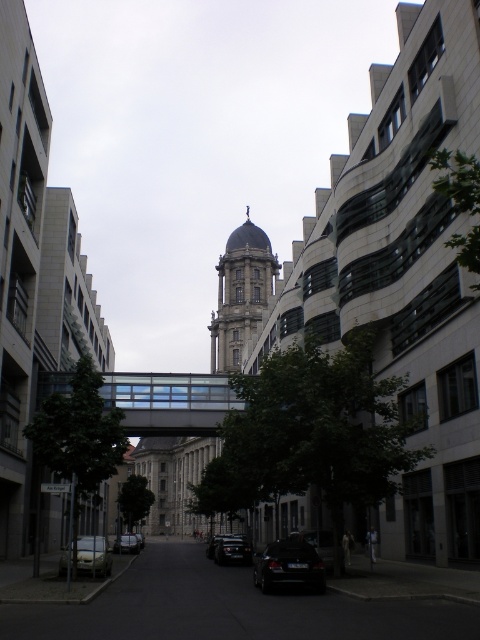
Is silver metallic car at lower left shorter than silver metallic car at center?

In fact, silver metallic car at lower left may be taller than silver metallic car at center.

What do you see at coordinates (94, 556) in the screenshot? The width and height of the screenshot is (480, 640). I see `silver metallic car at lower left` at bounding box center [94, 556].

Is point (88, 541) positioned behind point (132, 534)?

No, (88, 541) is in front of (132, 534).

Identify the location of silver metallic car at lower left. The height and width of the screenshot is (640, 480). (94, 556).

Does black glossy car at center appear under shiny black sedan at center?

No.

The height and width of the screenshot is (640, 480). I want to click on black glossy car at center, so click(232, 552).

Is point (231, 547) closer to viewer compared to point (205, 552)?

Yes.

Locate an element on the screen. black glossy car at center is located at coordinates tap(232, 552).

Between transparent glass bridge at center and shiny black sedan at center, which one appears on the right side from the viewer's perspective?

shiny black sedan at center is more to the right.

Does transparent glass bridge at center appear on the left side of shiny black sedan at center?

Correct, you'll find transparent glass bridge at center to the left of shiny black sedan at center.

I want to click on transparent glass bridge at center, so point(169,401).